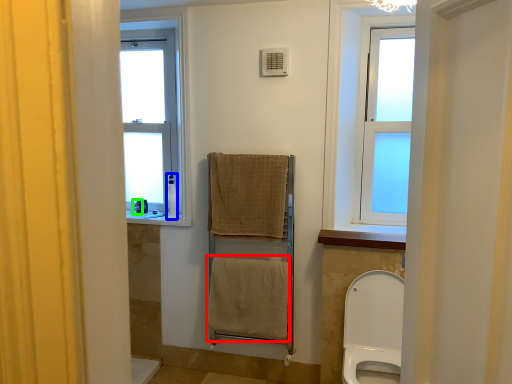
Question: Based on their relative distances, which object is farther from bath towel (highlighted by a red box)? Choose from toiletry (highlighted by a blue box) and toiletry (highlighted by a green box).

Choices:
 (A) toiletry
 (B) toiletry

Answer: (B)